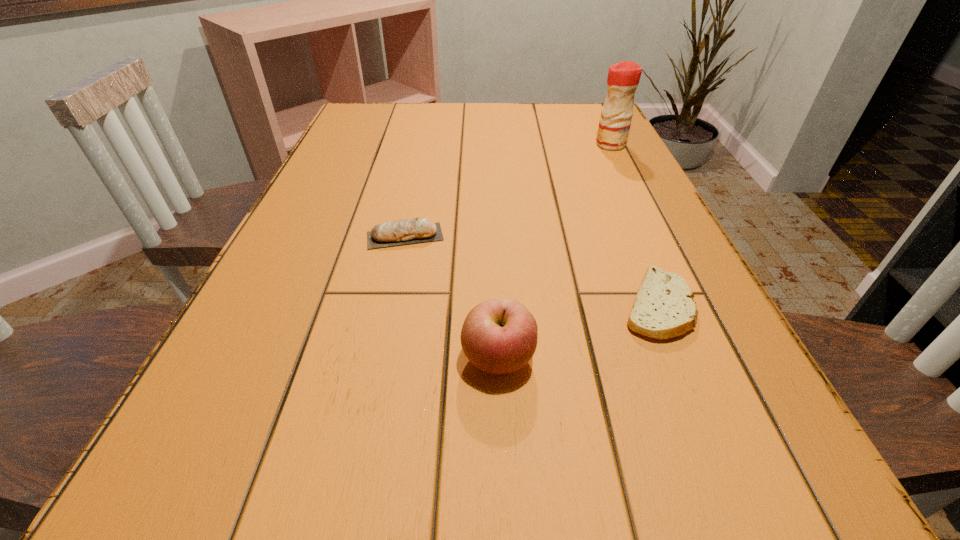
Where is `unoccupied position between the farthest object and the second shortest object`? This screenshot has height=540, width=960. unoccupied position between the farthest object and the second shortest object is located at coordinates (508, 191).

I want to click on free space between the farthest object and the shorter pita bread, so click(635, 225).

Image resolution: width=960 pixels, height=540 pixels. What are the coordinates of `free space between the right pita bread and the farther pita bread` in the screenshot? It's located at (532, 271).

This screenshot has width=960, height=540. I want to click on free point between the shorter pita bread and the third shortest object, so click(x=578, y=332).

I want to click on free point between the farthest object and the nearer pita bread, so click(x=635, y=225).

Locate an element on the screen. The width and height of the screenshot is (960, 540). blank region between the tallest object and the nearer pita bread is located at coordinates (635, 225).

Locate an element on the screen. This screenshot has height=540, width=960. vacant space in between the condiment and the shortest object is located at coordinates (635, 225).

The image size is (960, 540). I want to click on free area in between the third shortest object and the shorter pita bread, so click(x=578, y=332).

The height and width of the screenshot is (540, 960). Find the location of `vacant space that's between the farthest object and the nearer pita bread`. vacant space that's between the farthest object and the nearer pita bread is located at coordinates (635, 225).

Locate an element on the screen. blank region between the second shortest object and the nearer pita bread is located at coordinates (532, 271).